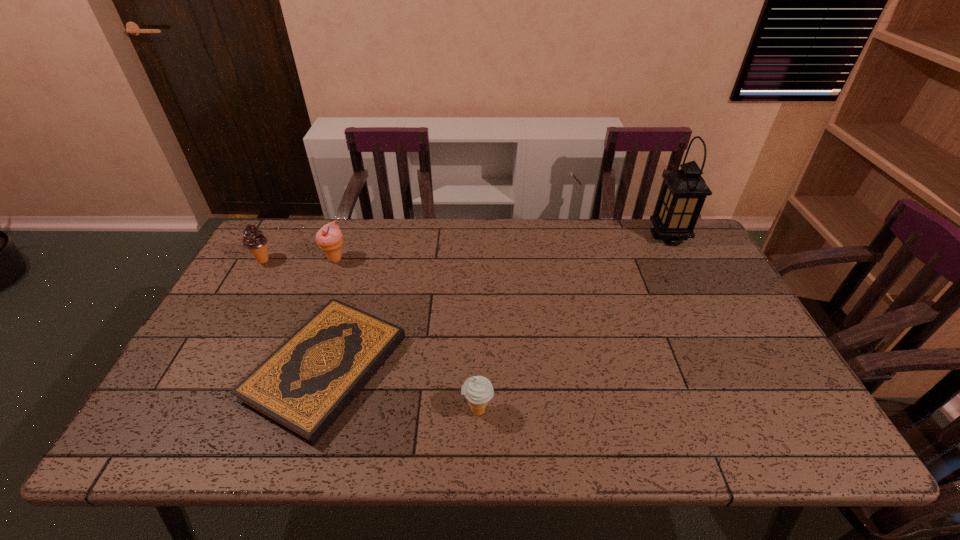
The height and width of the screenshot is (540, 960). I want to click on free space between the hardback book and the shortest icecream, so click(x=402, y=389).

Where is `empty space between the leftmost object and the shortest object`? The image size is (960, 540). empty space between the leftmost object and the shortest object is located at coordinates (295, 314).

Find the location of a particular element. The height and width of the screenshot is (540, 960). vacant area that lies between the rightmost object and the shortest object is located at coordinates (497, 302).

This screenshot has height=540, width=960. Find the location of `free point between the nearest icecream and the second icecream from left to right`. free point between the nearest icecream and the second icecream from left to right is located at coordinates (407, 335).

Identify which object is the second nearest to the hardback book. Please provide its 2D coordinates. Your answer should be formatted as a tuple, i.e. [(x, y)], where the tuple contains the x and y coordinates of a point satisfying the conditions above.

[(329, 238)]

Find the location of a particular element. This screenshot has height=540, width=960. object that is the second closest to the hardback book is located at coordinates (329, 238).

Identify which icecream is located as the nearest to the rightmost icecream. Please provide its 2D coordinates. Your answer should be formatted as a tuple, i.e. [(x, y)], where the tuple contains the x and y coordinates of a point satisfying the conditions above.

[(329, 238)]

Identify which icecream is the third closest to the tallest object. Please provide its 2D coordinates. Your answer should be formatted as a tuple, i.e. [(x, y)], where the tuple contains the x and y coordinates of a point satisfying the conditions above.

[(254, 240)]

This screenshot has width=960, height=540. Identify the location of free space that satisfies the following two spatial constraints: 1. on the back side of the rightmost object; 2. on the right side of the second object from right to left. (478, 237).

In order to click on vacant space that satisfies the following two spatial constraints: 1. on the back side of the leftmost object; 2. on the left side of the rightmost object in this screenshot , I will do `click(276, 237)`.